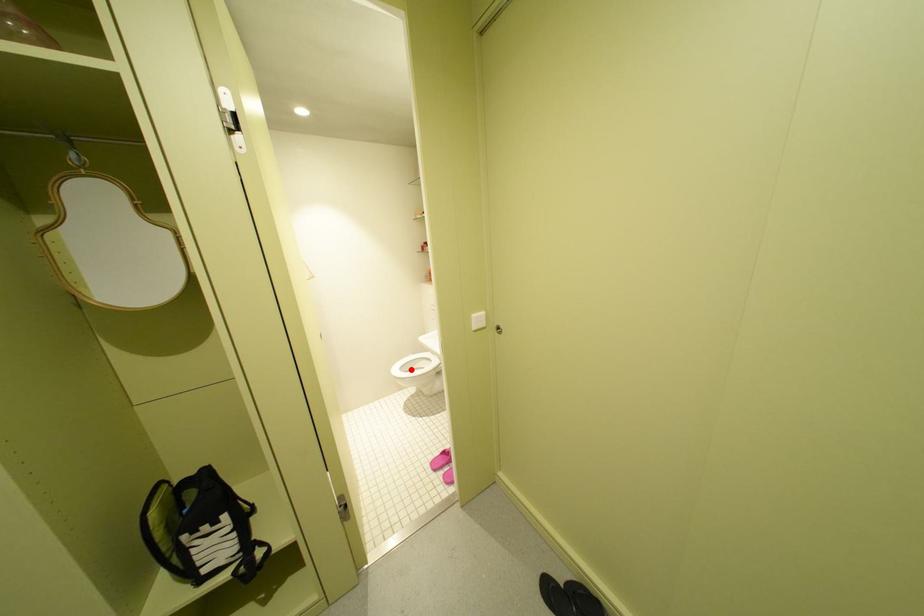
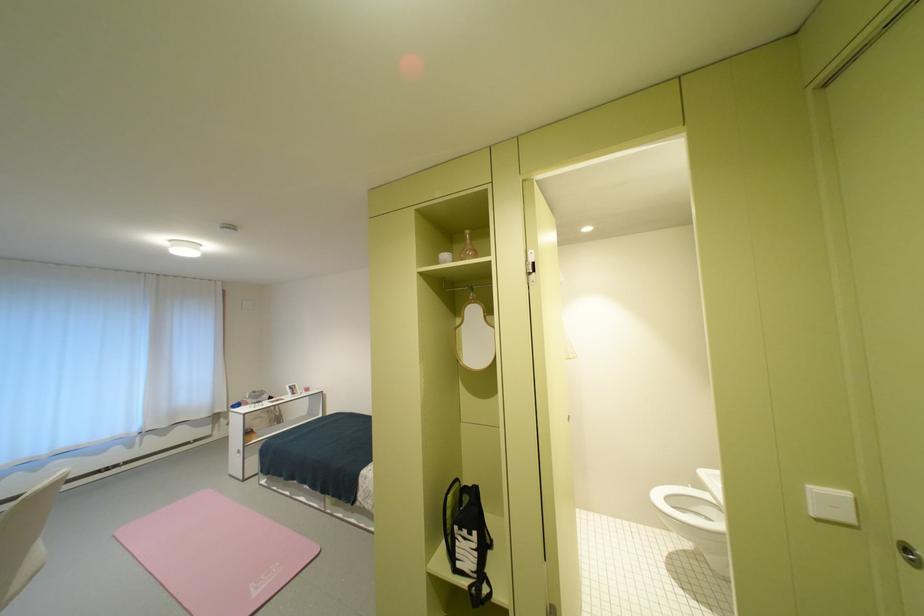
Locate, in the second image, the point that corresponds to the highlighted location in the first image.

(677, 500)